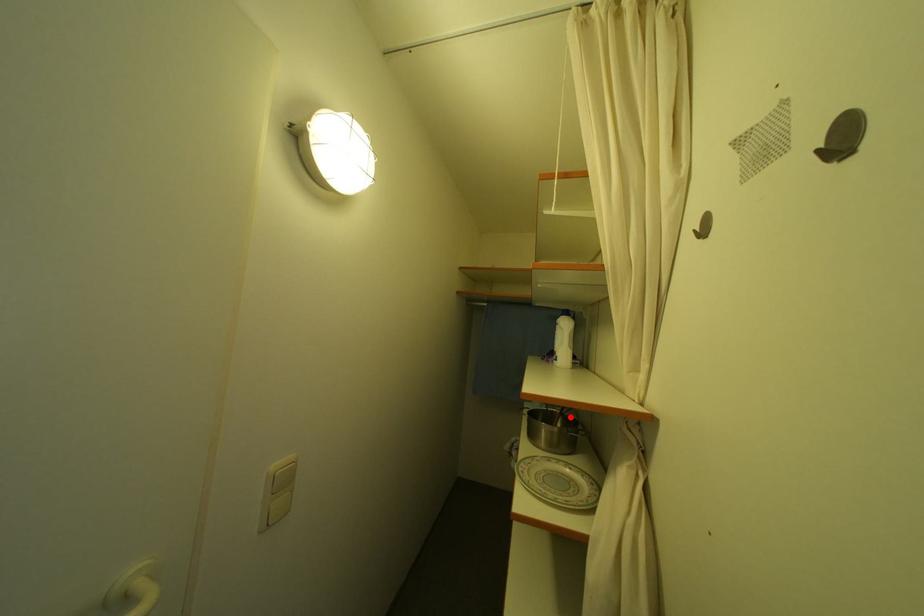
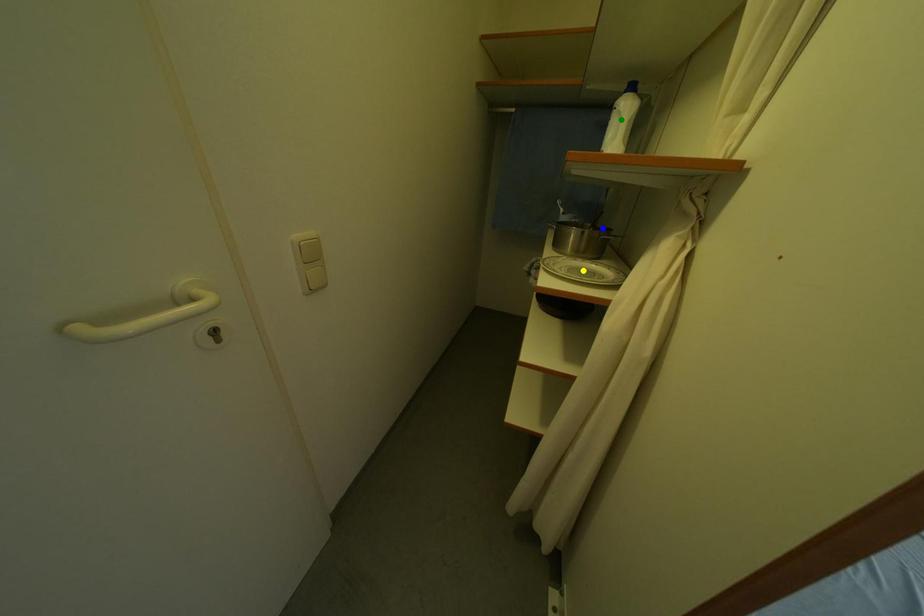
Question: I am providing you with two images of the same scene from different viewpoints. A red point is marked on the first image. You are given multiple points on the second image. Which point in image 2 is actually the same real-world point as the red point in image 1?

Choices:
 (A) blue point
 (B) green point
 (C) yellow point

Answer: (A)